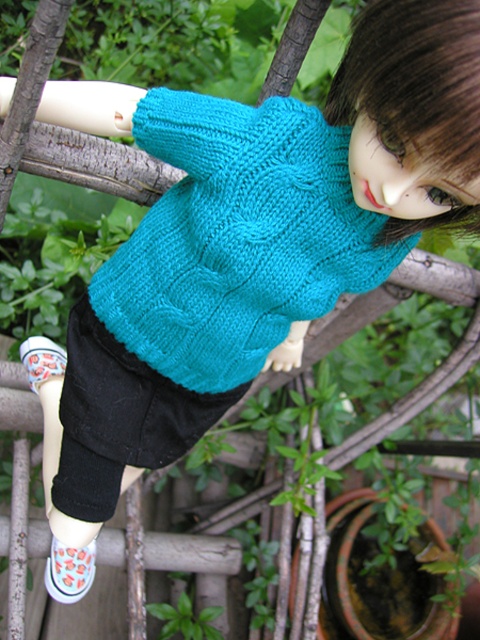
You are a fashion designer observing the doll in the garden. You need to describe the spatial relationship between the teal knitted sweater at upper center and the white canvas shoe at lower left. Which object is located to the right of the other?

The teal knitted sweater at upper center is positioned on the right side of white canvas shoe at lower left.

You are a tailor who wants to know if the teal knitted sweater at upper center can fit into a storage box designed for the white canvas shoe at lower left. Based on their widths, will the sweater fit?

The teal knitted sweater at upper center is wider than the white canvas shoe at lower left, so it will not fit into the storage box designed for the shoe.

You are a photographer trying to capture a closeup of the teal knitted sweater at upper center. The camera you are using has a minimum focusing distance of 80 centimeters. Can you take the photo without moving closer than the minimum distance?

The teal knitted sweater at upper center and camera are 83.64 centimeters apart from each other. Since the minimum focusing distance is 80 centimeters, you can take the photo without moving closer because the current distance is within the required range.